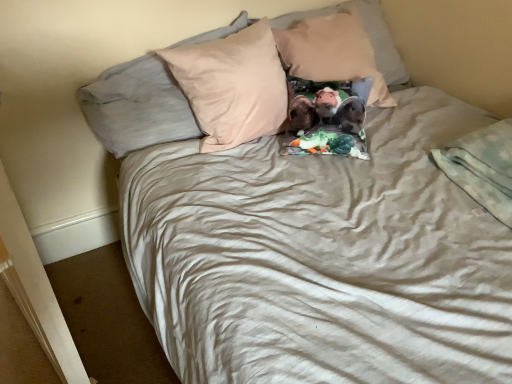
Where is `beige cotton pillow at center, which is the second pillow from left to right`? Image resolution: width=512 pixels, height=384 pixels. beige cotton pillow at center, which is the second pillow from left to right is located at coordinates (137, 106).

The image size is (512, 384). What do you see at coordinates (137, 106) in the screenshot? I see `beige cotton pillow at center, which is the second pillow from left to right` at bounding box center [137, 106].

Where is `light gray soft blanket at lower right`? The width and height of the screenshot is (512, 384). light gray soft blanket at lower right is located at coordinates (482, 167).

Is light gray soft blanket at lower right taller than beige fabric pillow at upper center, the 1th pillow positioned from the left?

No, light gray soft blanket at lower right is not taller than beige fabric pillow at upper center, the 1th pillow positioned from the left.

Locate an element on the screen. blanket that is below the beige fabric pillow at upper center, the 1th pillow positioned from the left (from the image's perspective) is located at coordinates (482, 167).

Considering the sizes of light gray soft blanket at lower right and beige fabric pillow at upper center, the 1th pillow positioned from the left, in the image, is light gray soft blanket at lower right bigger or smaller than beige fabric pillow at upper center, the 1th pillow positioned from the left,?

Considering their sizes, light gray soft blanket at lower right takes up less space than beige fabric pillow at upper center, the 1th pillow positioned from the left.

Is light gray soft blanket at lower right inside the boundaries of beige fabric pillow at upper center, placed as the third pillow when sorted from right to left, or outside?

light gray soft blanket at lower right exists outside the volume of beige fabric pillow at upper center, placed as the third pillow when sorted from right to left.

Could you measure the distance between fluffy fabric pillow at center, which is the 1th pillow in right-to-left order, and beige cotton pillow at center, arranged as the second pillow when viewed from the right?

fluffy fabric pillow at center, which is the 1th pillow in right-to-left order, and beige cotton pillow at center, arranged as the second pillow when viewed from the right, are 5.47 inches apart from each other.

Based on their sizes in the image, would you say fluffy fabric pillow at center, which is the 1th pillow in right-to-left order, is bigger or smaller than beige cotton pillow at center, which is the second pillow from left to right?

Considering their sizes, fluffy fabric pillow at center, which is the 1th pillow in right-to-left order, takes up less space than beige cotton pillow at center, which is the second pillow from left to right.

From the image's perspective, between fluffy fabric pillow at center, placed as the 3th pillow when sorted from left to right, and beige cotton pillow at center, which is the second pillow from left to right, who is located below?

beige cotton pillow at center, which is the second pillow from left to right, from the image's perspective.

Does fluffy fabric pillow at center, which is the 1th pillow in right-to-left order, turn towards beige cotton pillow at center, arranged as the second pillow when viewed from the right?

No, fluffy fabric pillow at center, which is the 1th pillow in right-to-left order, is not aimed at beige cotton pillow at center, arranged as the second pillow when viewed from the right.

Which point is more forward, (198, 127) or (104, 128)?

The point (104, 128) is closer to the camera.

Is beige cotton pillow at center, arranged as the second pillow when viewed from the right, oriented away from beige fabric pillow at upper center, placed as the third pillow when sorted from right to left?

Yes, beige cotton pillow at center, arranged as the second pillow when viewed from the right, is facing away from beige fabric pillow at upper center, placed as the third pillow when sorted from right to left.

Is beige cotton pillow at center, arranged as the second pillow when viewed from the right, shorter than beige fabric pillow at upper center, the 1th pillow positioned from the left?

In fact, beige cotton pillow at center, arranged as the second pillow when viewed from the right, may be taller than beige fabric pillow at upper center, the 1th pillow positioned from the left.

From the image's perspective, which object appears higher, beige fabric pillow at upper center, placed as the third pillow when sorted from right to left, or light gray soft blanket at lower right?

beige fabric pillow at upper center, placed as the third pillow when sorted from right to left.

Is point (199, 39) farther from viewer compared to point (506, 131)?

Yes, it is behind point (506, 131).

Considering the positions of objects beige fabric pillow at upper center, the 1th pillow positioned from the left, and light gray soft blanket at lower right in the image provided, who is behind, beige fabric pillow at upper center, the 1th pillow positioned from the left, or light gray soft blanket at lower right?

beige fabric pillow at upper center, the 1th pillow positioned from the left, is further from the camera.

Is beige fabric pillow at upper center, the 1th pillow positioned from the left, shorter than fluffy fabric pillow at center, which is the 1th pillow in right-to-left order?

No, beige fabric pillow at upper center, the 1th pillow positioned from the left, is not shorter than fluffy fabric pillow at center, which is the 1th pillow in right-to-left order.

Is beige fabric pillow at upper center, placed as the third pillow when sorted from right to left, not close to fluffy fabric pillow at center, placed as the 3th pillow when sorted from left to right?

No.

Would you say beige fabric pillow at upper center, the 1th pillow positioned from the left, is inside or outside fluffy fabric pillow at center, which is the 1th pillow in right-to-left order?

beige fabric pillow at upper center, the 1th pillow positioned from the left, lies outside fluffy fabric pillow at center, which is the 1th pillow in right-to-left order.

Is light gray soft blanket at lower right taller than fluffy fabric pillow at center, which is the 1th pillow in right-to-left order?

In fact, light gray soft blanket at lower right may be shorter than fluffy fabric pillow at center, which is the 1th pillow in right-to-left order.

Is light gray soft blanket at lower right inside or outside of fluffy fabric pillow at center, placed as the 3th pillow when sorted from left to right?

light gray soft blanket at lower right is outside fluffy fabric pillow at center, placed as the 3th pillow when sorted from left to right.

Does light gray soft blanket at lower right have a greater width compared to fluffy fabric pillow at center, placed as the 3th pillow when sorted from left to right?

No.

Image resolution: width=512 pixels, height=384 pixels. Find the location of `blanket below the fluffy fabric pillow at center, placed as the 3th pillow when sorted from left to right (from a real-world perspective)`. blanket below the fluffy fabric pillow at center, placed as the 3th pillow when sorted from left to right (from a real-world perspective) is located at coordinates (482, 167).

Which of these two, beige cotton pillow at center, which is the second pillow from left to right, or fluffy fabric pillow at center, placed as the 3th pillow when sorted from left to right, is wider?

Wider between the two is fluffy fabric pillow at center, placed as the 3th pillow when sorted from left to right.

Is beige cotton pillow at center, which is the second pillow from left to right, oriented towards fluffy fabric pillow at center, placed as the 3th pillow when sorted from left to right?

No, beige cotton pillow at center, which is the second pillow from left to right, is not facing towards fluffy fabric pillow at center, placed as the 3th pillow when sorted from left to right.

From a real-world perspective, between beige cotton pillow at center, arranged as the second pillow when viewed from the right, and fluffy fabric pillow at center, which is the 1th pillow in right-to-left order, who is vertically higher?

fluffy fabric pillow at center, which is the 1th pillow in right-to-left order, from a real-world perspective.

What's the angular difference between beige cotton pillow at center, which is the second pillow from left to right, and fluffy fabric pillow at center, placed as the 3th pillow when sorted from left to right,'s facing directions?

The angular difference between beige cotton pillow at center, which is the second pillow from left to right, and fluffy fabric pillow at center, placed as the 3th pillow when sorted from left to right, is 77.5 degrees.

Image resolution: width=512 pixels, height=384 pixels. Identify the location of blanket in front of the beige fabric pillow at upper center, the 1th pillow positioned from the left. (482, 167).

You are a GUI agent. You are given a task and a screenshot of the screen. Output one action in this format:
    pyautogui.click(x=<x>, y=<y>)
    Task: Click on the 2nd pillow above the beige cotton pillow at center, arranged as the second pillow when viewed from the right (from the image's perspective)
    Image resolution: width=512 pixels, height=384 pixels.
    Given the screenshot: What is the action you would take?
    pyautogui.click(x=367, y=35)

Which object lies nearer to the anchor point beige fabric pillow at upper center, the 1th pillow positioned from the left, beige cotton pillow at center, which is the second pillow from left to right, or fluffy fabric pillow at center, which is the 1th pillow in right-to-left order?

beige cotton pillow at center, which is the second pillow from left to right, lies closer to beige fabric pillow at upper center, the 1th pillow positioned from the left, than the other object.

Considering their positions, is light gray soft blanket at lower right positioned closer to beige fabric pillow at upper center, placed as the third pillow when sorted from right to left, than beige cotton pillow at center, which is the second pillow from left to right?

beige cotton pillow at center, which is the second pillow from left to right.

Which object lies nearer to the anchor point light gray soft blanket at lower right, beige fabric pillow at upper center, the 1th pillow positioned from the left, or beige cotton pillow at center, arranged as the second pillow when viewed from the right?

beige cotton pillow at center, arranged as the second pillow when viewed from the right, is closer to light gray soft blanket at lower right.

Based on their spatial positions, is beige cotton pillow at center, which is the second pillow from left to right, or beige fabric pillow at upper center, placed as the third pillow when sorted from right to left, closer to light gray soft blanket at lower right?

Based on the image, beige cotton pillow at center, which is the second pillow from left to right, appears to be nearer to light gray soft blanket at lower right.

Considering their positions, is light gray soft blanket at lower right positioned closer to fluffy fabric pillow at center, which is the 1th pillow in right-to-left order, than beige fabric pillow at upper center, placed as the third pillow when sorted from right to left?

beige fabric pillow at upper center, placed as the third pillow when sorted from right to left, lies closer to fluffy fabric pillow at center, which is the 1th pillow in right-to-left order, than the other object.

Based on their spatial positions, is light gray soft blanket at lower right or fluffy fabric pillow at center, which is the 1th pillow in right-to-left order, further from beige fabric pillow at upper center, placed as the third pillow when sorted from right to left?

light gray soft blanket at lower right is positioned further to the anchor beige fabric pillow at upper center, placed as the third pillow when sorted from right to left.

When comparing their distances from light gray soft blanket at lower right, does fluffy fabric pillow at center, which is the 1th pillow in right-to-left order, or beige cotton pillow at center, which is the second pillow from left to right, seem further?

beige cotton pillow at center, which is the second pillow from left to right, lies further to light gray soft blanket at lower right than the other object.

Which object lies nearer to the anchor point beige cotton pillow at center, which is the second pillow from left to right, beige fabric pillow at upper center, placed as the third pillow when sorted from right to left, or light gray soft blanket at lower right?

Among the two, beige fabric pillow at upper center, placed as the third pillow when sorted from right to left, is located nearer to beige cotton pillow at center, which is the second pillow from left to right.

Find the location of a particular element. The width and height of the screenshot is (512, 384). pillow between beige fabric pillow at upper center, the 1th pillow positioned from the left, and fluffy fabric pillow at center, placed as the 3th pillow when sorted from left to right, from left to right is located at coordinates (137, 106).

Find the location of a particular element. Image resolution: width=512 pixels, height=384 pixels. pillow between beige cotton pillow at center, which is the second pillow from left to right, and light gray soft blanket at lower right is located at coordinates tap(367, 35).